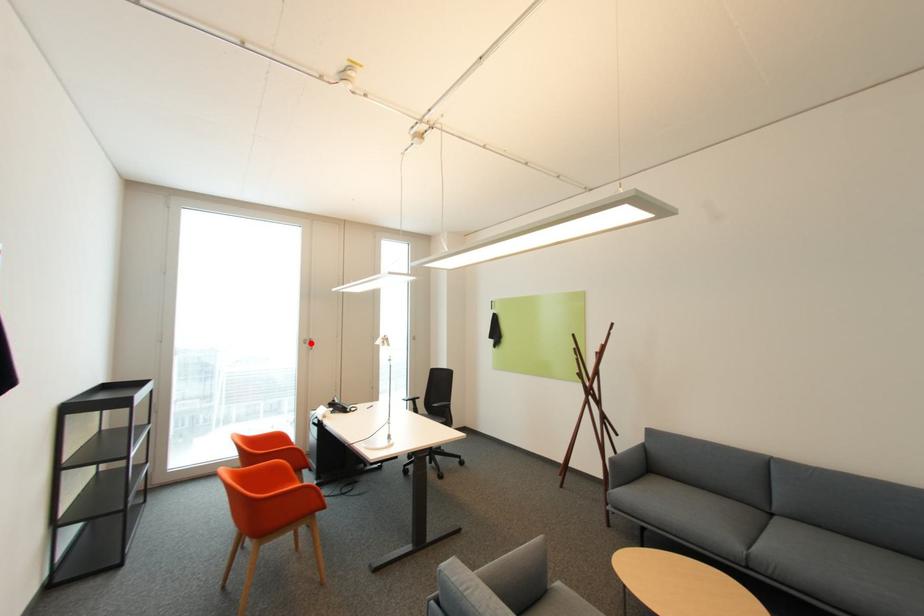
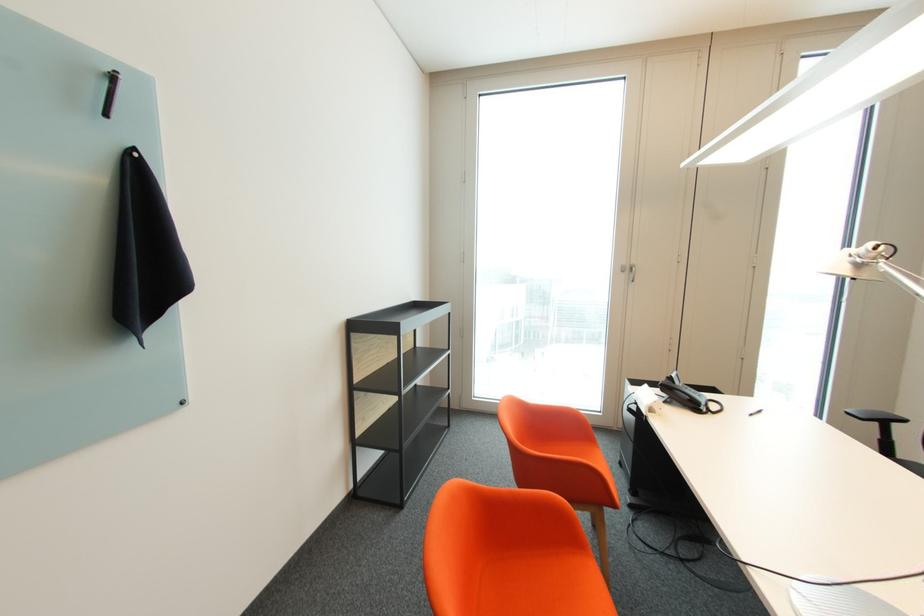
Find the pixel in the second image that matches the highlighted location in the first image.

(629, 272)